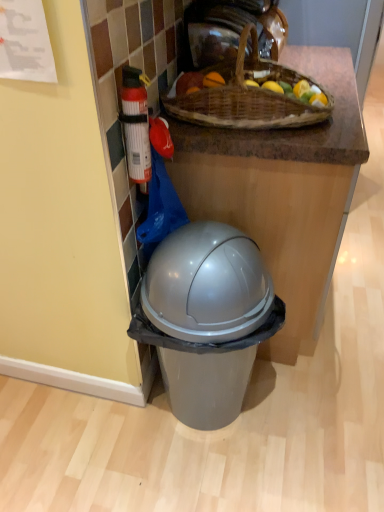
Question: Is brown woven picnic basket at upper center inside the boundaries of white plastic fire extinguisher at left, or outside?

Choices:
 (A) outside
 (B) inside

Answer: (A)

Question: Considering the positions of point (175, 105) and point (125, 84), is point (175, 105) closer or farther from the camera than point (125, 84)?

Choices:
 (A) farther
 (B) closer

Answer: (A)

Question: In terms of size, does brown woven picnic basket at upper center appear bigger or smaller than white plastic fire extinguisher at left?

Choices:
 (A) small
 (B) big

Answer: (B)

Question: Is white plastic fire extinguisher at left in front of or behind brown woven picnic basket at upper center in the image?

Choices:
 (A) behind
 (B) front

Answer: (B)

Question: In terms of width, does white plastic fire extinguisher at left look wider or thinner when compared to brown woven picnic basket at upper center?

Choices:
 (A) wide
 (B) thin

Answer: (B)

Question: Considering the positions of white plastic fire extinguisher at left and brown woven picnic basket at upper center in the image, is white plastic fire extinguisher at left taller or shorter than brown woven picnic basket at upper center?

Choices:
 (A) short
 (B) tall

Answer: (B)

Question: Considering the positions of white plastic fire extinguisher at left and brown woven picnic basket at upper center in the image, is white plastic fire extinguisher at left bigger or smaller than brown woven picnic basket at upper center?

Choices:
 (A) small
 (B) big

Answer: (A)